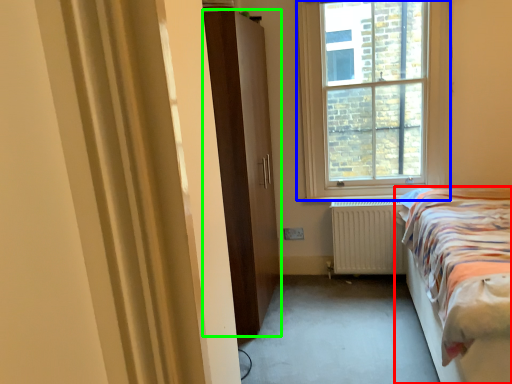
Question: Which object is positioned farthest from bed (highlighted by a red box)? Select from window (highlighted by a blue box) and door (highlighted by a green box).

Choices:
 (A) window
 (B) door

Answer: (B)